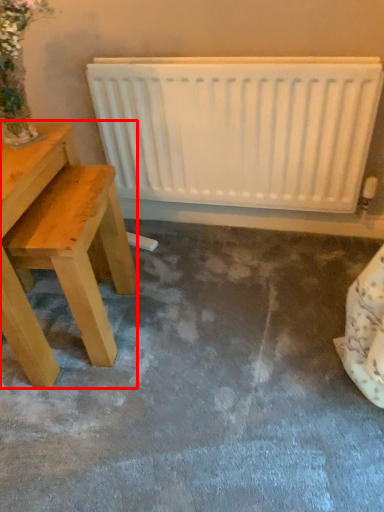
Question: From the image's perspective, considering the relative positions of table (annotated by the red box) and radiator in the image provided, where is table (annotated by the red box) located with respect to the staircase?

Choices:
 (A) above
 (B) below

Answer: (B)